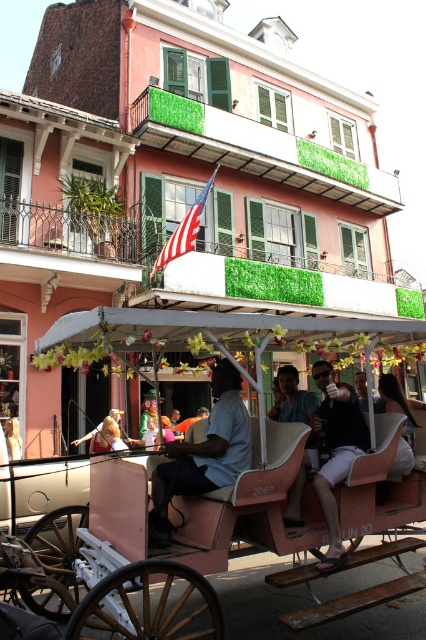
Does pink matte horse cart at center have a greater width compared to black matte shirt at center?

No.

Can you confirm if pink matte horse cart at center is thinner than black matte shirt at center?

Indeed, pink matte horse cart at center has a lesser width compared to black matte shirt at center.

Who is more distant from viewer, (314, 321) or (350, 465)?

The point (350, 465) is behind.

The width and height of the screenshot is (426, 640). What are the coordinates of `pink matte horse cart at center` in the screenshot? It's located at (233, 340).

Does matte blue shirt at center have a lesser height compared to black matte shirt at center?

Correct, matte blue shirt at center is not as tall as black matte shirt at center.

Does point (233, 372) come in front of point (340, 417)?

Yes, it is.

Who is more distant from viewer, (210, 420) or (319, 417)?

The point (319, 417) is more distant.

Where is `matte blue shirt at center`? The width and height of the screenshot is (426, 640). matte blue shirt at center is located at coordinates (204, 452).

Can you confirm if pink matte horse cart at center is shorter than matte blue shirt at center?

Correct, pink matte horse cart at center is not as tall as matte blue shirt at center.

From the picture: Does pink matte horse cart at center appear under matte blue shirt at center?

Yes, pink matte horse cart at center is below matte blue shirt at center.

Who is more distant from viewer, (299, 330) or (230, 432)?

The point (230, 432) is behind.

You are a GUI agent. You are given a task and a screenshot of the screen. Output one action in this format:
    pyautogui.click(x=<x>, y=<y>)
    Task: Click on the pink matte horse cart at center
    This screenshot has height=640, width=426.
    Given the screenshot: What is the action you would take?
    pyautogui.click(x=233, y=340)